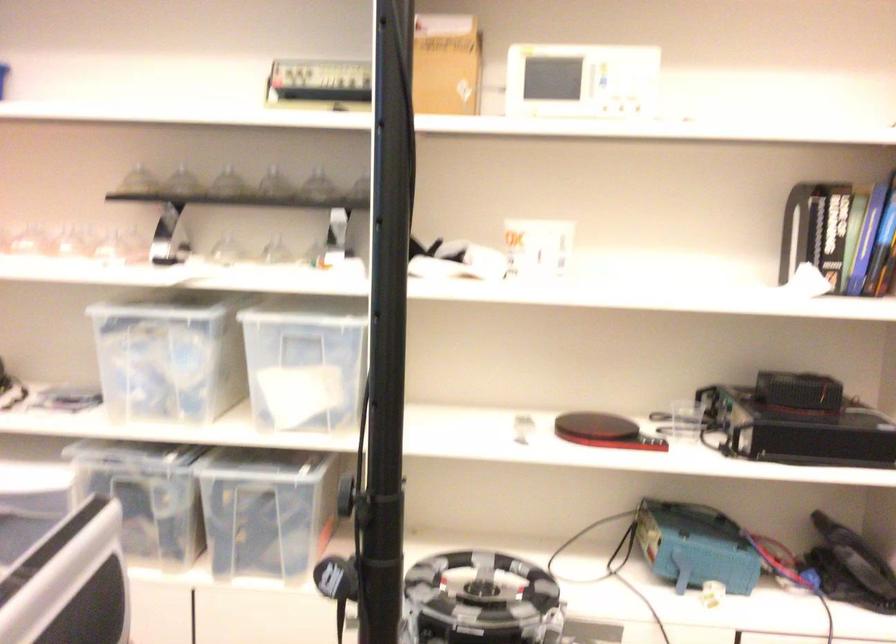
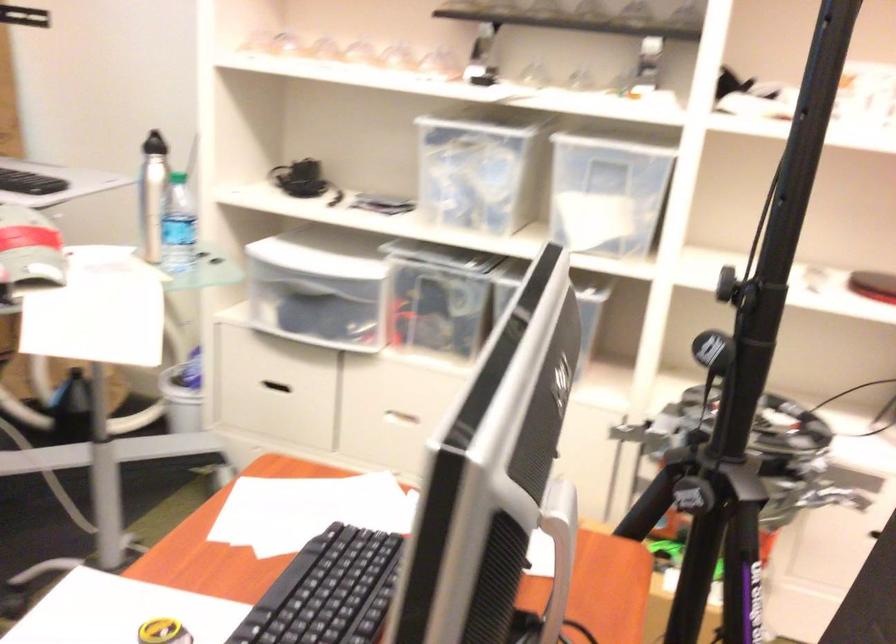
Question: Based on the continuous images, in which direction is the camera rotating? Reply with the corresponding letter.

Choices:
 (A) Left
 (B) Right
 (C) Up
 (D) Down

Answer: (A)